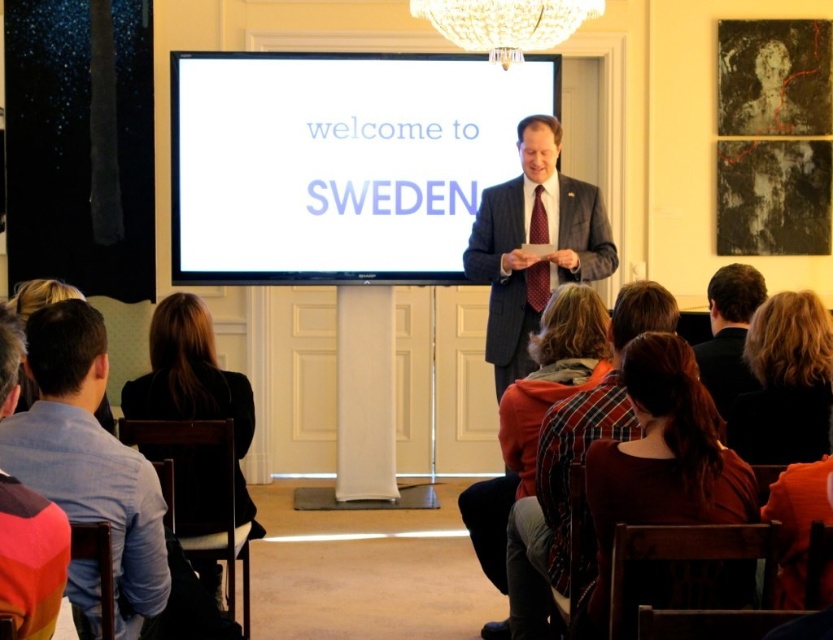
Question: Which object is the closest to the plaid wool suit at center?

Choices:
 (A) multicolored fabric at lower left
 (B) dark brown leather chair at lower right
 (C) white glossy projection screen at center

Answer: (C)

Question: Is plaid wool suit at center positioned at the back of multicolored fabric at lower left?

Choices:
 (A) no
 (B) yes

Answer: (B)

Question: Is blue shirt at lower left smaller than black suit at right?

Choices:
 (A) no
 (B) yes

Answer: (A)

Question: Does black fabric jacket at lower left appear under plaid wool suit at center?

Choices:
 (A) yes
 (B) no

Answer: (A)

Question: Which of the following is the farthest from the observer?

Choices:
 (A) plaid shirt at center
 (B) blue shirt at lower left

Answer: (A)

Question: Among these points, which one is nearest to the camera?

Choices:
 (A) (532, 234)
 (B) (382, 122)
 (C) (502, 189)

Answer: (A)